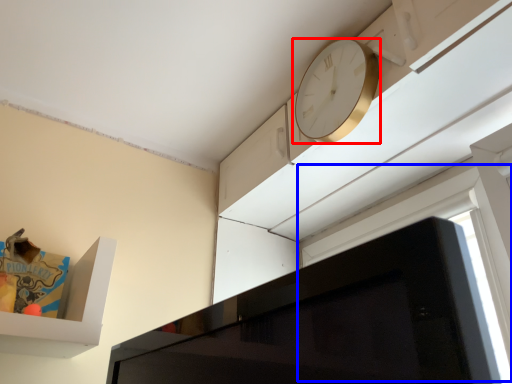
Question: Among these objects, which one is farthest to the camera, clock (highlighted by a red box) or window (highlighted by a blue box)?

Choices:
 (A) clock
 (B) window

Answer: (A)